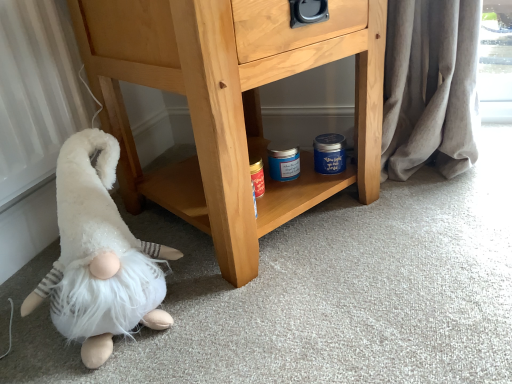
Question: Is white fluffy gnome at lower left not near light brown wood chest of drawers at center?

Choices:
 (A) no
 (B) yes

Answer: (A)

Question: Considering the relative sizes of white fluffy gnome at lower left and light brown wood chest of drawers at center in the image provided, is white fluffy gnome at lower left thinner than light brown wood chest of drawers at center?

Choices:
 (A) yes
 (B) no

Answer: (A)

Question: Considering the relative positions of white fluffy gnome at lower left and light brown wood chest of drawers at center in the image provided, is white fluffy gnome at lower left behind light brown wood chest of drawers at center?

Choices:
 (A) yes
 (B) no

Answer: (B)

Question: Is white fluffy gnome at lower left looking in the opposite direction of light brown wood chest of drawers at center?

Choices:
 (A) no
 (B) yes

Answer: (A)

Question: Considering the relative positions of white fluffy gnome at lower left and light brown wood chest of drawers at center in the image provided, is white fluffy gnome at lower left in front of light brown wood chest of drawers at center?

Choices:
 (A) yes
 (B) no

Answer: (A)

Question: Can you confirm if white fluffy gnome at lower left is positioned to the right of light brown wood chest of drawers at center?

Choices:
 (A) yes
 (B) no

Answer: (B)

Question: Is white fluffy gnome at lower left completely or partially inside light brown wood chest of drawers at center?

Choices:
 (A) yes
 (B) no

Answer: (B)

Question: Considering the relative sizes of light brown wood chest of drawers at center and white fluffy gnome at lower left in the image provided, is light brown wood chest of drawers at center bigger than white fluffy gnome at lower left?

Choices:
 (A) no
 (B) yes

Answer: (B)

Question: From the image's perspective, does light brown wood chest of drawers at center appear higher than white fluffy gnome at lower left?

Choices:
 (A) yes
 (B) no

Answer: (A)

Question: Is light brown wood chest of drawers at center at the left side of white fluffy gnome at lower left?

Choices:
 (A) yes
 (B) no

Answer: (B)

Question: Is light brown wood chest of drawers at center shorter than white fluffy gnome at lower left?

Choices:
 (A) yes
 (B) no

Answer: (B)

Question: Is white fluffy gnome at lower left at the back of light brown wood chest of drawers at center?

Choices:
 (A) yes
 (B) no

Answer: (B)

Question: In the image, is white fluffy gnome at lower left on the left side or the right side of light brown wood chest of drawers at center?

Choices:
 (A) left
 (B) right

Answer: (A)